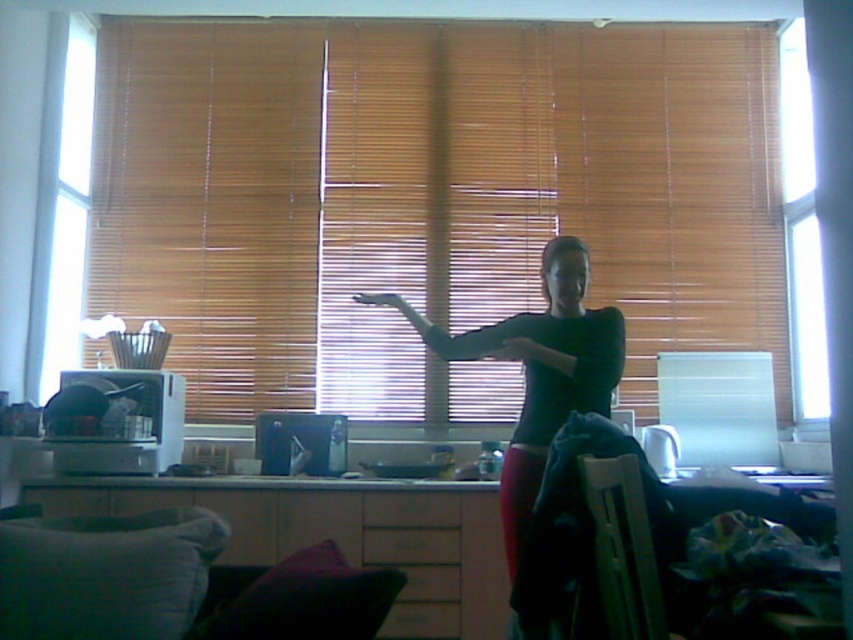
Between matte black hand at center and matte plastic hand at center, which one appears on the right side from the viewer's perspective?

matte black hand at center

Between matte black hand at center and matte plastic hand at center, which one is positioned higher?

matte plastic hand at center is above.

Find the location of `matte black hand at center`. matte black hand at center is located at coordinates (515, 349).

Between point (808, 170) and point (515, 344), which one is positioned in front?

Point (515, 344)

Can you confirm if transparent glass window at upper right is wider than matte black hand at center?

Indeed, transparent glass window at upper right has a greater width compared to matte black hand at center.

This screenshot has height=640, width=853. Describe the element at coordinates (801, 232) in the screenshot. I see `transparent glass window at upper right` at that location.

Locate an element on the screen. transparent glass window at upper right is located at coordinates (801, 232).

Is transparent glass window at upper right taller than matte plastic hand at center?

Correct, transparent glass window at upper right is much taller as matte plastic hand at center.

Is transparent glass window at upper right below matte plastic hand at center?

Incorrect, transparent glass window at upper right is not positioned below matte plastic hand at center.

What do you see at coordinates (801, 232) in the screenshot? I see `transparent glass window at upper right` at bounding box center [801, 232].

Locate an element on the screen. transparent glass window at upper right is located at coordinates (801, 232).